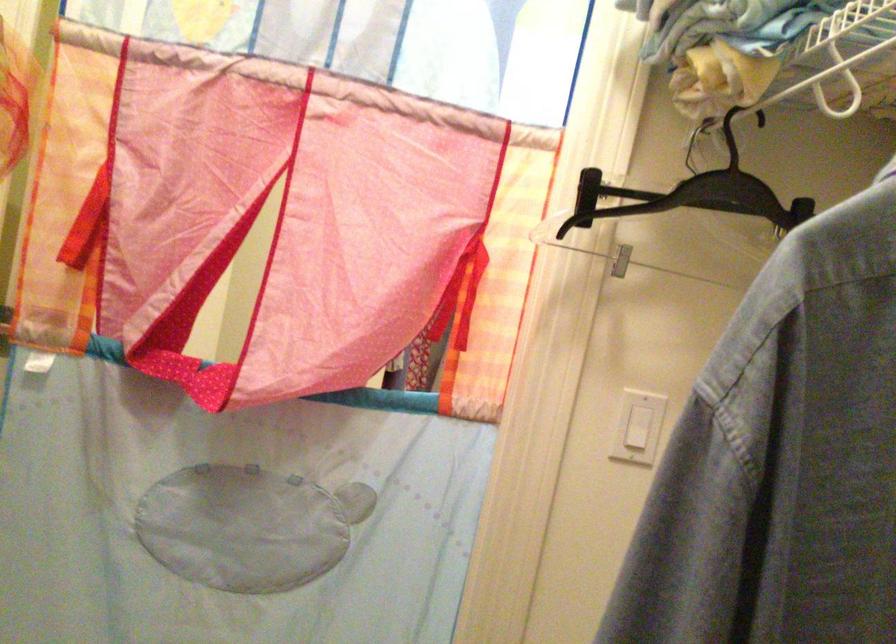
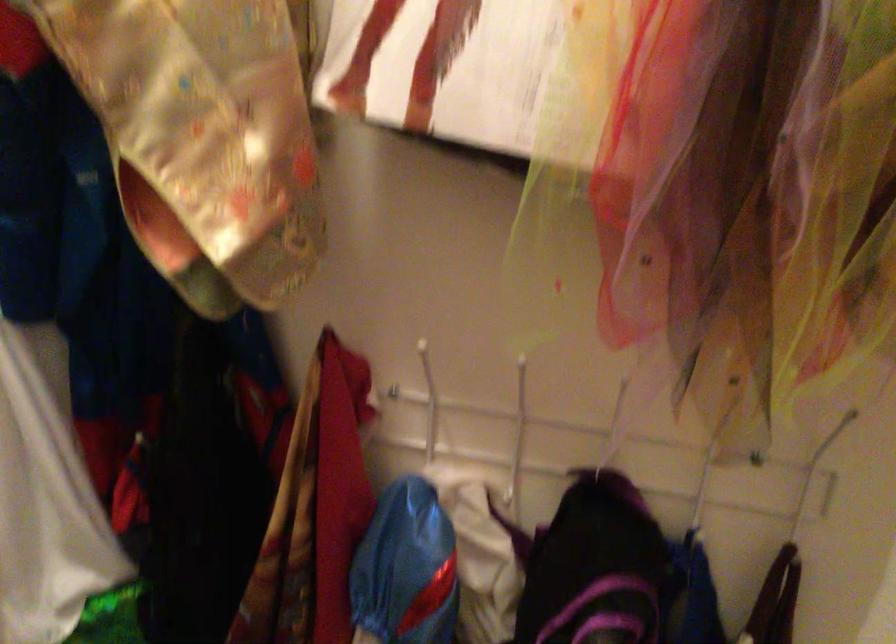
Question: The images are taken continuously from a first-person perspective. In which direction is your viewpoint rotating?

Choices:
 (A) Left
 (B) Right
 (C) Up
 (D) Down

Answer: (A)